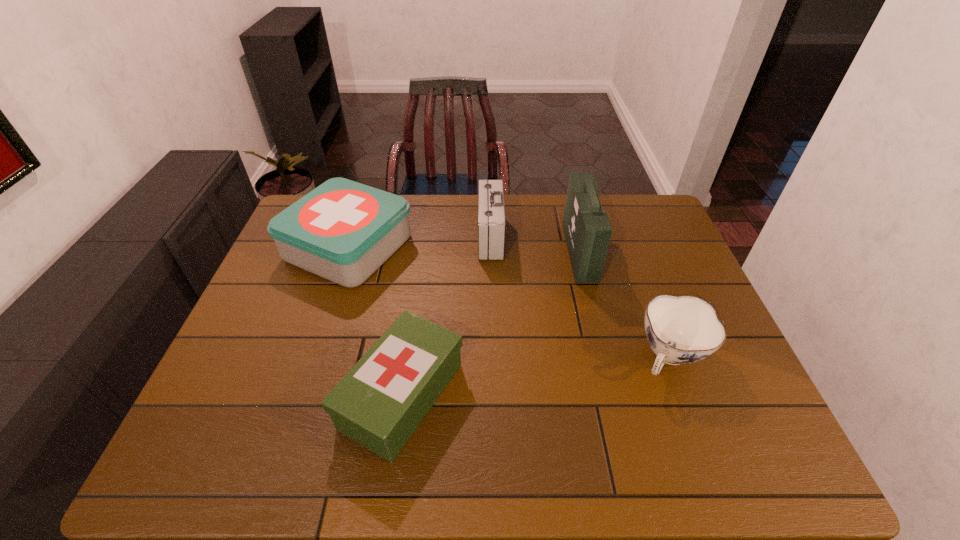
Locate an element on the screen. blank space located on the front-facing side of the third object from left to right is located at coordinates (399, 237).

At what (x,y) coordinates should I click in order to perform the action: click on free space located on the back of the rightmost object. Please return your answer as a coordinate pair (x, y). The width and height of the screenshot is (960, 540). Looking at the image, I should click on (625, 239).

Find the location of `free space located on the left of the nearest first-aid kit`. free space located on the left of the nearest first-aid kit is located at coordinates (312, 396).

Identify the location of object positioned at the near edge. This screenshot has height=540, width=960. (379, 403).

The width and height of the screenshot is (960, 540). Identify the location of object at the left edge. (343, 231).

What are the coordinates of `object positioned at the right edge` in the screenshot? It's located at (684, 329).

The image size is (960, 540). What are the coordinates of `object that is at the far left corner` in the screenshot? It's located at (343, 231).

The image size is (960, 540). Identify the location of vacant space at the far edge of the desktop. (537, 194).

Find the location of a particular element. The height and width of the screenshot is (540, 960). vacant region at the left edge of the desktop is located at coordinates [298, 306].

Where is `free region at the near right corner of the desktop`? The width and height of the screenshot is (960, 540). free region at the near right corner of the desktop is located at coordinates (780, 469).